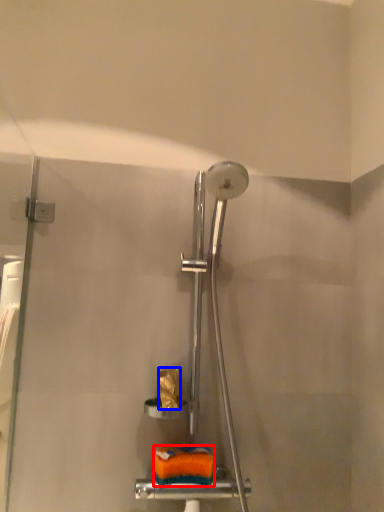
Question: Which point is closer to the camera, material (highlighted by a red box) or toilet paper (highlighted by a blue box)?

Choices:
 (A) material
 (B) toilet paper

Answer: (A)